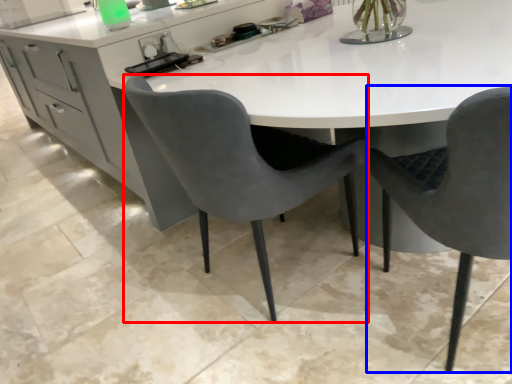
Question: Which point is closer to the camera, chair (highlighted by a red box) or chair (highlighted by a blue box)?

Choices:
 (A) chair
 (B) chair

Answer: (B)